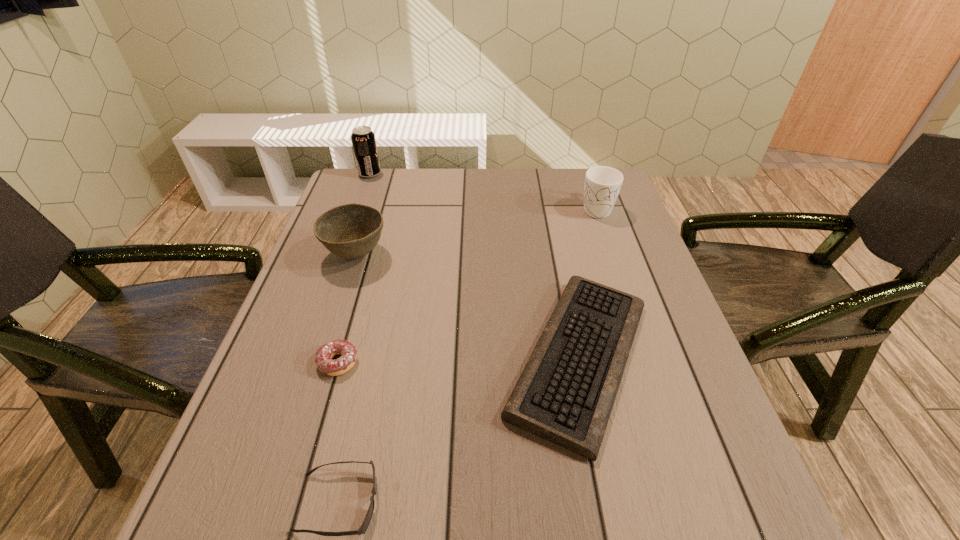
Select which object is the second closest to the fourth nearest object. Please provide its 2D coordinates. Your answer should be formatted as a tuple, i.e. [(x, y)], where the tuple contains the x and y coordinates of a point satisfying the conditions above.

[(565, 394)]

Select which object is the fourth closest to the sunglasses. Please provide its 2D coordinates. Your answer should be formatted as a tuple, i.e. [(x, y)], where the tuple contains the x and y coordinates of a point satisfying the conditions above.

[(602, 185)]

The image size is (960, 540). Find the location of `free space that satisfies the following two spatial constraints: 1. on the back side of the doughnut; 2. on the right side of the computer keyboard`. free space that satisfies the following two spatial constraints: 1. on the back side of the doughnut; 2. on the right side of the computer keyboard is located at coordinates (340, 358).